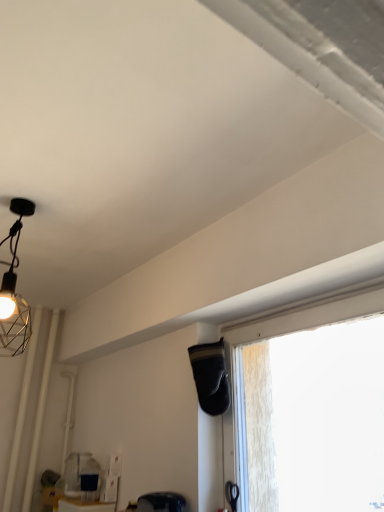
Question: Considering the positions of transparent glass window at center and matte black swivel chair at lower center in the image, is transparent glass window at center wider or thinner than matte black swivel chair at lower center?

Choices:
 (A) wide
 (B) thin

Answer: (B)

Question: Is transparent glass window at center bigger or smaller than matte black swivel chair at lower center?

Choices:
 (A) big
 (B) small

Answer: (A)

Question: From the image's perspective, is transparent glass window at center positioned above or below matte black swivel chair at lower center?

Choices:
 (A) above
 (B) below

Answer: (A)

Question: From the image's perspective, relative to transparent glass window at center, is matte black swivel chair at lower center above or below?

Choices:
 (A) above
 (B) below

Answer: (B)

Question: Considering the positions of point (155, 503) and point (377, 308), is point (155, 503) closer or farther from the camera than point (377, 308)?

Choices:
 (A) farther
 (B) closer

Answer: (A)

Question: Is matte black swivel chair at lower center in front of or behind transparent glass window at center in the image?

Choices:
 (A) front
 (B) behind

Answer: (B)

Question: From a real-world perspective, relative to transparent glass window at center, is matte black swivel chair at lower center vertically above or below?

Choices:
 (A) above
 (B) below

Answer: (B)